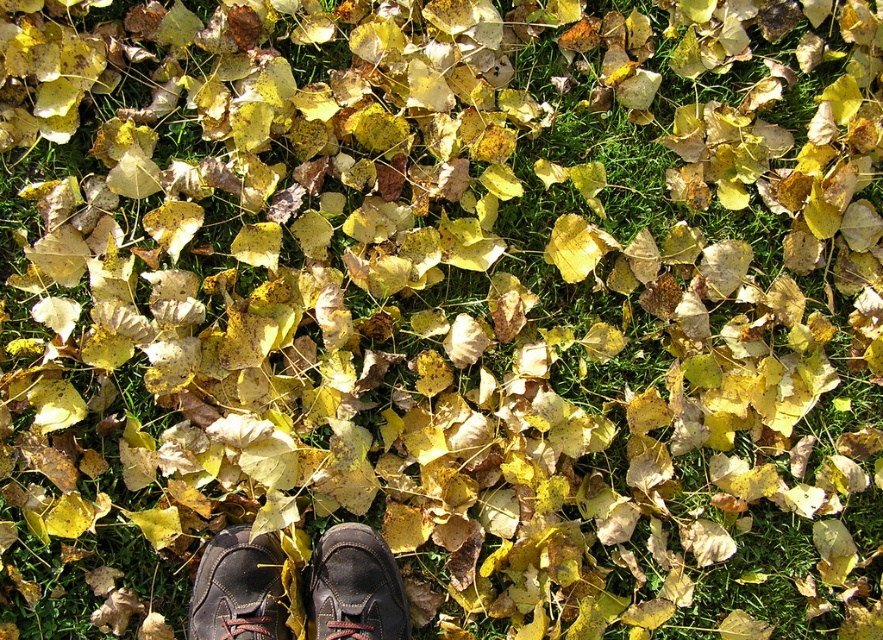
You are a person trying to pick up the leaves in the scene. You notice two shoes at the center of the image. How far apart are the black leather shoes at center and the matte black shoe at center?

The black leather shoes at center and the matte black shoe at center are 1.93 inches apart from each other.

You are standing in an autumn scene with fallen leaves and need to place a small potted plant exactly where the black leather shoes at center are currently positioned. Based on the coordinates provided, can you confirm if the spot is suitable for placing the plant?

The black leather shoes at center are located at coordinates point [355,586], so yes, the spot is suitable for placing the plant as it specifies an exact position.

You are trying to decide which shoe to wear for a hike. Both the matte black shoe at center and the dark brown leather shoe at center are options. Based on their sizes, which one might be more suitable for carrying a heavy backpack?

The dark brown leather shoe at center is larger in size compared to the matte black shoe at center, making it more suitable for carrying a heavy backpack as larger shoes typically provide better support and comfort for such loads.